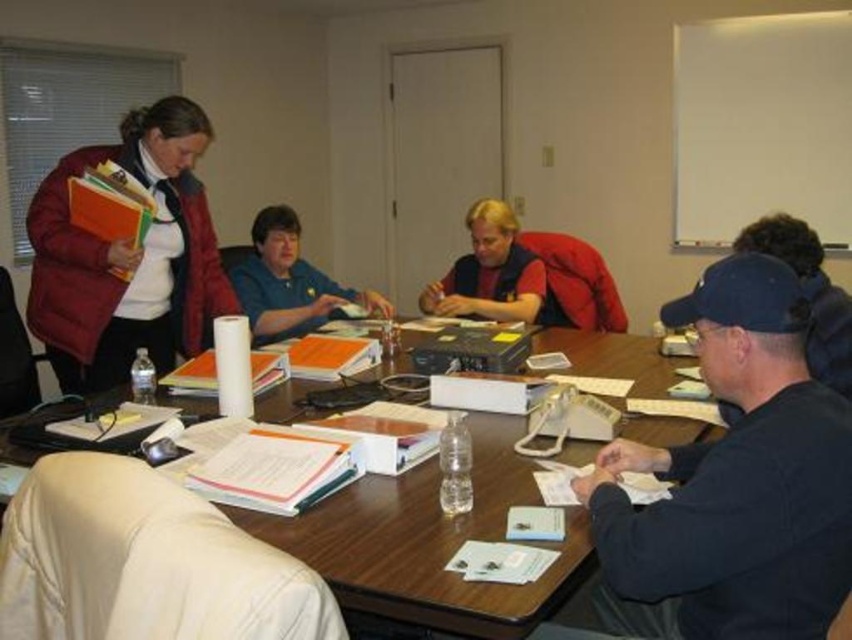
You are a new attendee entering the meeting room and see the wooden table at center and the matte red shirt at center. Which object is closer to you as you enter the room?

The wooden table at center is positioned under the matte red shirt at center, so the matte red shirt at center is closer to you as you enter the room.